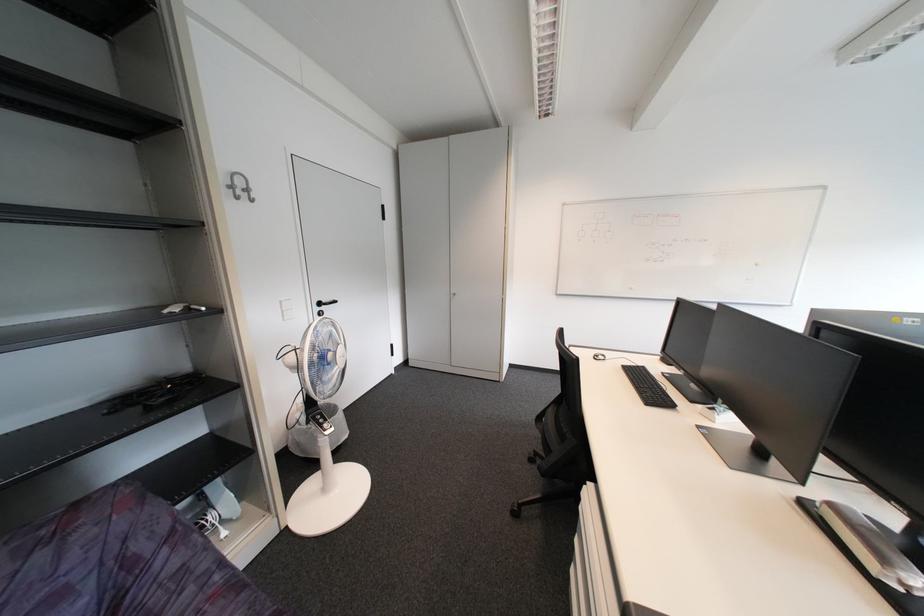
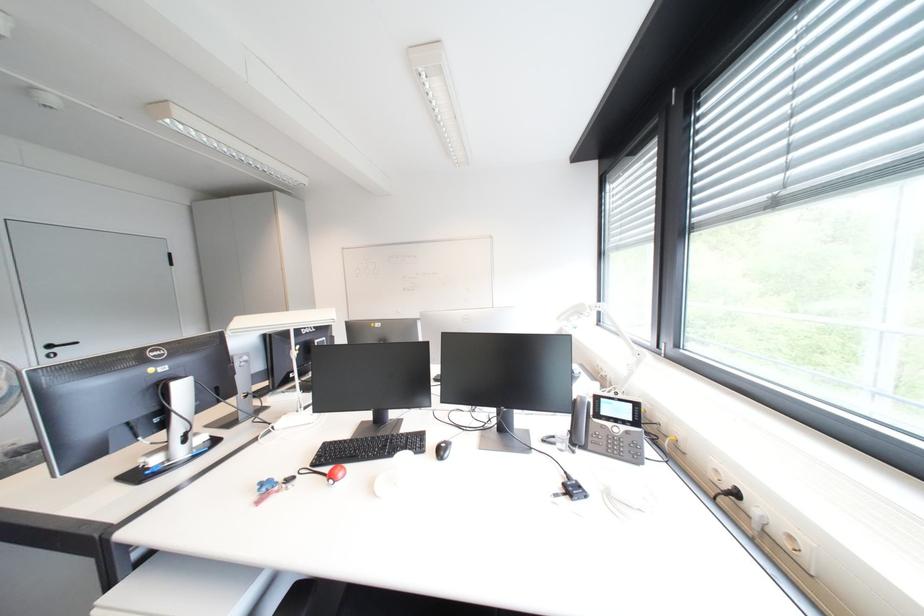
Which direction would the cameraman need to move to produce the second image?

The movement direction of the cameraman is right, backward.